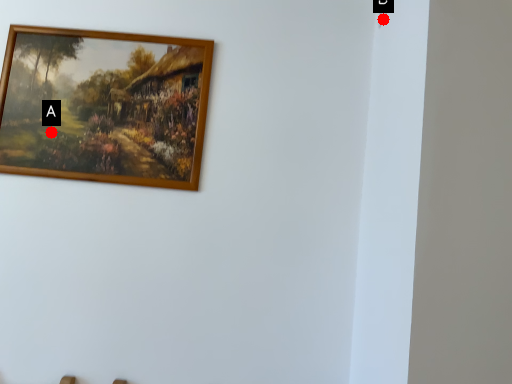
Question: Two points are circled on the image, labeled by A and B beside each circle. Which point appears farthest from the camera in this image?

Choices:
 (A) A is further
 (B) B is further

Answer: (A)